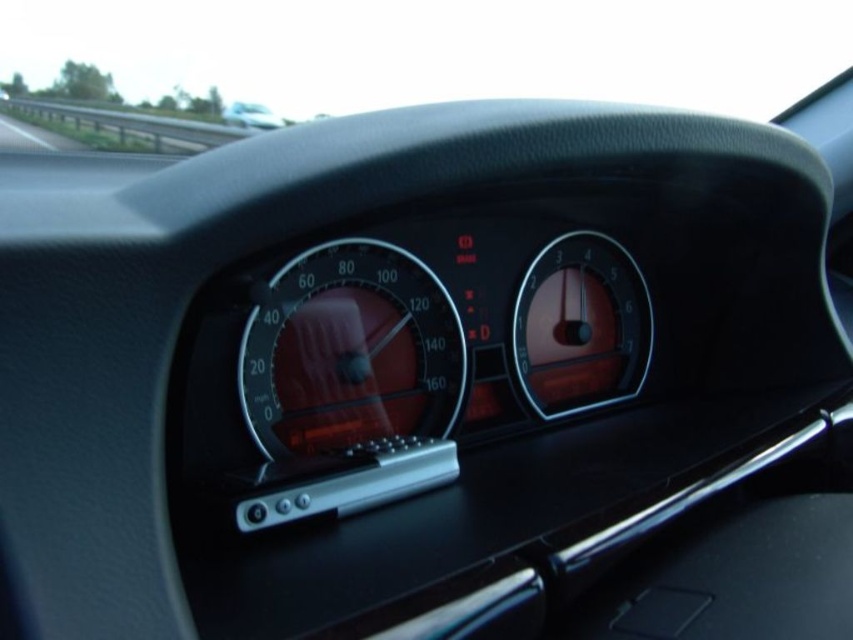
Question: Which is farther from the matte black gauge at center?

Choices:
 (A) matte black dashboard at center
 (B) glossy plastic speedometer at center
 (C) metallic gray guardrail at upper left

Answer: (C)

Question: Which of the following is the closest to the observer?

Choices:
 (A) (3, 99)
 (B) (349, 332)
 (C) (224, 109)
 (D) (583, 387)

Answer: (B)

Question: Which point is closer to the camera?

Choices:
 (A) (518, 332)
 (B) (259, 124)
 (C) (120, 120)
 (D) (392, 420)

Answer: (D)

Question: Can you confirm if glossy plastic speedometer at center is positioned above matte black dashboard at center?

Choices:
 (A) no
 (B) yes

Answer: (A)

Question: From the image, what is the correct spatial relationship of metallic gray guardrail at upper left in relation to matte black dashboard at center?

Choices:
 (A) right
 (B) left

Answer: (B)

Question: Does matte black gauge at center have a smaller size compared to metallic gray guardrail at upper left?

Choices:
 (A) yes
 (B) no

Answer: (A)